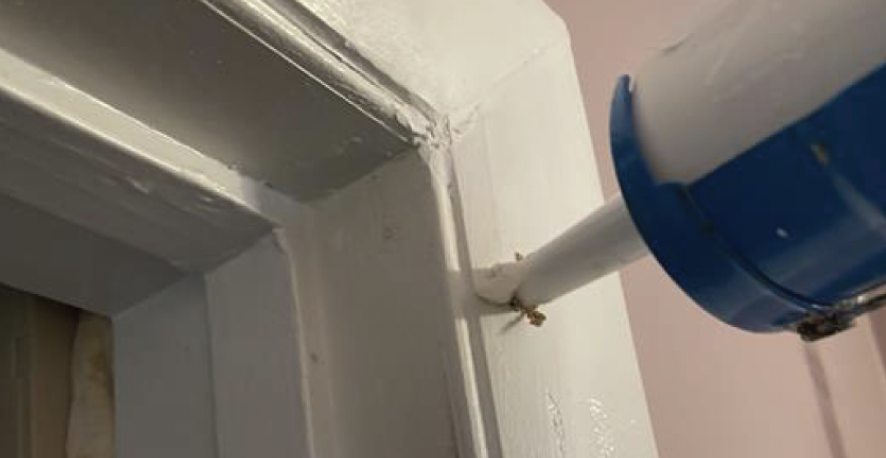
Identify the location of door frame. (377, 197).